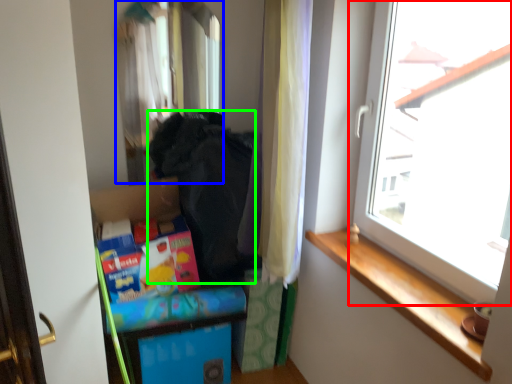
Question: Which object is positioned farthest from window (highlighted by a red box)? Select from mirror (highlighted by a blue box) and clothing (highlighted by a green box).

Choices:
 (A) mirror
 (B) clothing

Answer: (A)